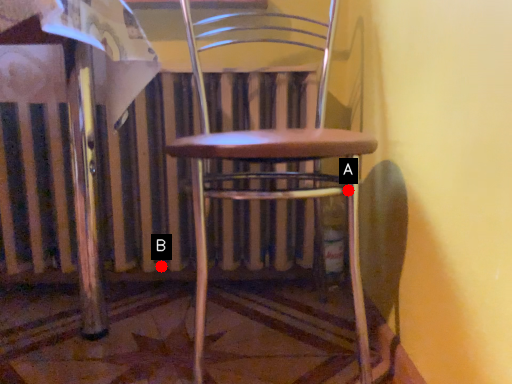
Question: Two points are circled on the image, labeled by A and B beside each circle. Which of the following is the farthest from the observer?

Choices:
 (A) A is further
 (B) B is further

Answer: (B)